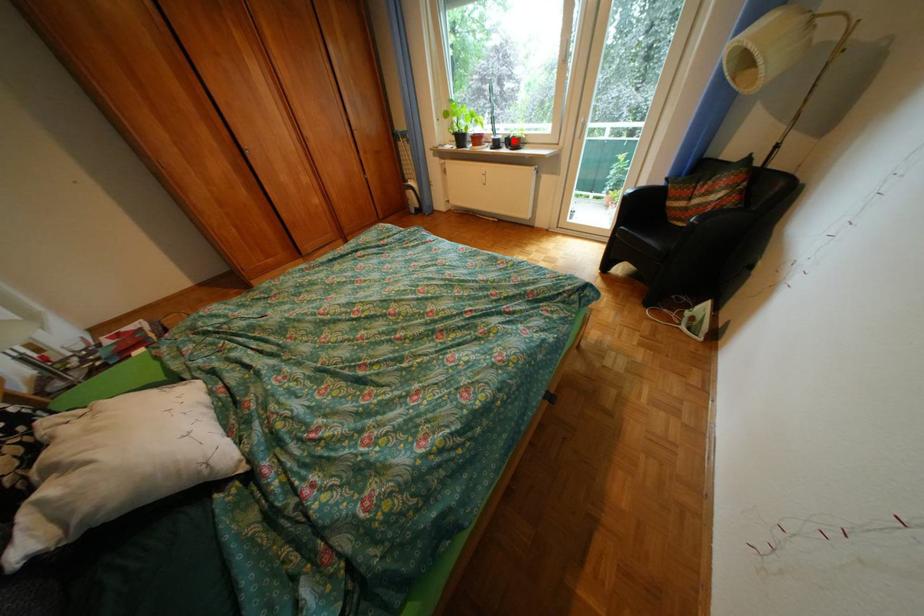
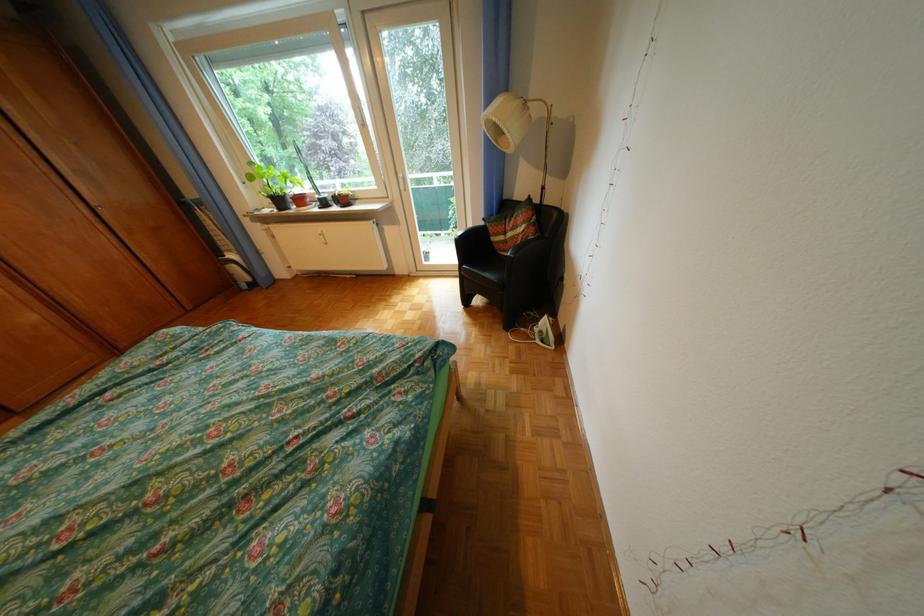
Question: I am providing you with two images of the same scene from different viewpoints. A red point is shown in image1. For the corresponding object point in image2, is it positioned nearer or farther from the camera?

Choices:
 (A) Nearer
 (B) Farther

Answer: (A)